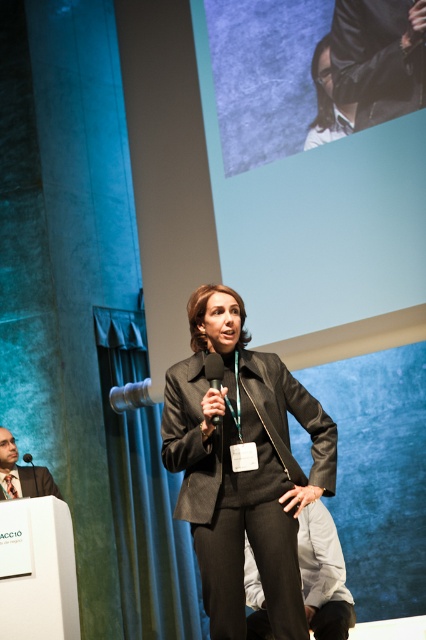
Who is positioned more to the right, gray fabric pants at lower center or black matte microphone at center?

gray fabric pants at lower center

Does point (337, 604) lie behind point (28, 458)?

No, it is not.

Which is behind, point (342, 596) or point (25, 458)?

The point (25, 458) is behind.

The width and height of the screenshot is (426, 640). In order to click on gray fabric pants at lower center in this screenshot , I will do `click(322, 573)`.

Between matte black suit at center and gray fabric pants at lower center, which one is positioned lower?

gray fabric pants at lower center

Is point (218, 442) positioned behind point (331, 572)?

No, (218, 442) is closer to viewer.

Identify the location of matte black suit at center. This screenshot has width=426, height=640. (242, 472).

Who is taller, gray fabric pants at lower center or black plastic microphone at center?

gray fabric pants at lower center

Which is more to the left, gray fabric pants at lower center or black plastic microphone at center?

Positioned to the left is black plastic microphone at center.

Where is `gray fabric pants at lower center`? gray fabric pants at lower center is located at coordinates (322, 573).